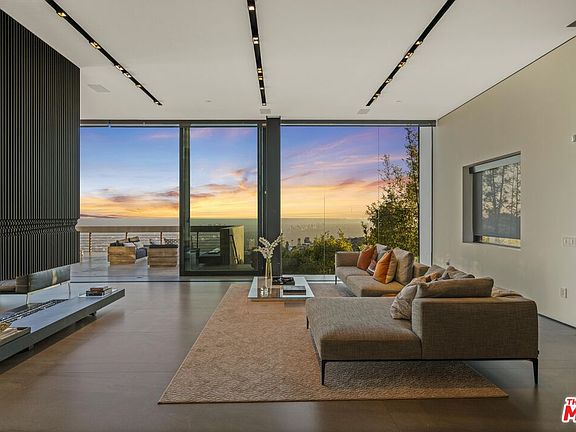
Find the where people would sit in the image. Your answer should be formatted as a list of tuples, i.e. [(x1, y1), (x2, y2), ...], where each tuple contains the x and y coordinates of a point satisfying the conditions above.

[(350, 266), (360, 283), (367, 333)]